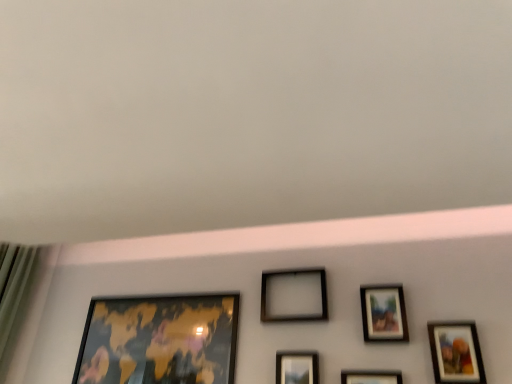
Describe the element at coordinates (370, 377) in the screenshot. This screenshot has height=384, width=512. I see `matte black picture frame at center, the fourth picture frame viewed from the left` at that location.

What do you see at coordinates (159, 340) in the screenshot? Image resolution: width=512 pixels, height=384 pixels. I see `gold metallic map at lower left, which is the first picture frame in left-to-right order` at bounding box center [159, 340].

In order to face matte wooden picture frame at lower right, which appears as the sixth picture frame when viewed from the left, should I rotate leftwards or rightwards?

Turn right by 25.231 degrees to look at matte wooden picture frame at lower right, which appears as the sixth picture frame when viewed from the left.

What is the approximate height of matte black picture frame at center, the 2th picture frame positioned from the left?

The height of matte black picture frame at center, the 2th picture frame positioned from the left, is 20.56 centimeters.

Find the location of a particular element. The image size is (512, 384). matte black picture frame at center, the fourth picture frame viewed from the left is located at coordinates (370, 377).

Does gold metallic map at lower left, which is the first picture frame in left-to-right order, have a larger size compared to matte black picture frame at center, the 2th picture frame positioned from the left?

Indeed, gold metallic map at lower left, which is the first picture frame in left-to-right order, has a larger size compared to matte black picture frame at center, the 2th picture frame positioned from the left.

From the image's perspective, is gold metallic map at lower left, which is the first picture frame in left-to-right order, over matte black picture frame at center, the 2th picture frame positioned from the left?

Yes, from the image's perspective, gold metallic map at lower left, which is the first picture frame in left-to-right order, is above matte black picture frame at center, the 2th picture frame positioned from the left.

Would you say gold metallic map at lower left, the 6th picture frame viewed from the right, is to the left or to the right of matte black picture frame at center, the 2th picture frame positioned from the left, in the picture?

From the image, it's evident that gold metallic map at lower left, the 6th picture frame viewed from the right, is to the left of matte black picture frame at center, the 2th picture frame positioned from the left.

Could matte wooden picture frame at lower right, which appears as the sixth picture frame when viewed from the left, be considered to be inside gold metallic map at lower left, the 6th picture frame viewed from the right?

No, matte wooden picture frame at lower right, which appears as the sixth picture frame when viewed from the left, is not inside gold metallic map at lower left, the 6th picture frame viewed from the right.

Does gold metallic map at lower left, which is the first picture frame in left-to-right order, have a lesser height compared to matte wooden picture frame at lower right, positioned as the 1th picture frame in right-to-left order?

No.

Consider the image. Are gold metallic map at lower left, which is the first picture frame in left-to-right order, and matte wooden picture frame at lower right, which appears as the sixth picture frame when viewed from the left, far apart?

gold metallic map at lower left, which is the first picture frame in left-to-right order, is near matte wooden picture frame at lower right, which appears as the sixth picture frame when viewed from the left, not far away.

Which object is positioned more to the right, gold metallic map at lower left, which is the first picture frame in left-to-right order, or matte wooden picture frame at lower right, positioned as the 1th picture frame in right-to-left order?

matte wooden picture frame at lower right, positioned as the 1th picture frame in right-to-left order.

Does point (300, 370) come behind point (325, 281)?

No, it is in front of (325, 281).

From the image's perspective, starting from the black matte picture frame at center, which ranks as the 3th picture frame in left-to-right order, which picture frame is the 4th one below? Please provide its 2D coordinates.

[(297, 367)]

Is black matte picture frame at center, acting as the fourth picture frame starting from the right, at the back of matte black picture frame at center, the 2th picture frame positioned from the left?

No, matte black picture frame at center, the 2th picture frame positioned from the left,'s orientation is not away from black matte picture frame at center, acting as the fourth picture frame starting from the right.

Between matte black picture frame at center, the fifth picture frame positioned from the right, and matte wooden picture frame at upper right, the 2th picture frame viewed from the right, which one is positioned in front?

matte black picture frame at center, the fifth picture frame positioned from the right, is closer to the camera.

Does matte black picture frame at center, the 2th picture frame positioned from the left, have a lesser width compared to matte wooden picture frame at upper right, the 2th picture frame viewed from the right?

No, matte black picture frame at center, the 2th picture frame positioned from the left, is not thinner than matte wooden picture frame at upper right, the 2th picture frame viewed from the right.

Looking at this image, considering the relative sizes of matte black picture frame at center, the 2th picture frame positioned from the left, and matte wooden picture frame at upper right, positioned as the fifth picture frame in left-to-right order, in the image provided, is matte black picture frame at center, the 2th picture frame positioned from the left, taller than matte wooden picture frame at upper right, positioned as the fifth picture frame in left-to-right order,?

No.

Is matte black picture frame at center, the fifth picture frame positioned from the right, aimed at matte wooden picture frame at upper right, positioned as the fifth picture frame in left-to-right order?

No, matte black picture frame at center, the fifth picture frame positioned from the right, is not turned towards matte wooden picture frame at upper right, positioned as the fifth picture frame in left-to-right order.

Is point (287, 363) closer to camera compared to point (342, 371)?

No, (287, 363) is behind (342, 371).

Considering the relative sizes of matte black picture frame at center, the 2th picture frame positioned from the left, and matte black picture frame at center, the fourth picture frame viewed from the left, in the image provided, is matte black picture frame at center, the 2th picture frame positioned from the left, bigger than matte black picture frame at center, the fourth picture frame viewed from the left,?

Indeed, matte black picture frame at center, the 2th picture frame positioned from the left, has a larger size compared to matte black picture frame at center, the fourth picture frame viewed from the left.

From a real-world perspective, is matte black picture frame at center, the 2th picture frame positioned from the left, positioned under matte black picture frame at center, the fourth picture frame viewed from the left, based on gravity?

Incorrect, from a real-world perspective, matte black picture frame at center, the 2th picture frame positioned from the left, is higher than matte black picture frame at center, the fourth picture frame viewed from the left.

Measure the distance between gold metallic map at lower left, the 6th picture frame viewed from the right, and black matte picture frame at center, which ranks as the 3th picture frame in left-to-right order.

gold metallic map at lower left, the 6th picture frame viewed from the right, and black matte picture frame at center, which ranks as the 3th picture frame in left-to-right order, are 15.65 inches apart from each other.

Is point (211, 352) positioned behind point (279, 279)?

No, it is not.

Does gold metallic map at lower left, which is the first picture frame in left-to-right order, touch black matte picture frame at center, which ranks as the 3th picture frame in left-to-right order?

No, gold metallic map at lower left, which is the first picture frame in left-to-right order, is not making contact with black matte picture frame at center, which ranks as the 3th picture frame in left-to-right order.

Considering the relative sizes of gold metallic map at lower left, the 6th picture frame viewed from the right, and black matte picture frame at center, which ranks as the 3th picture frame in left-to-right order, in the image provided, is gold metallic map at lower left, the 6th picture frame viewed from the right, shorter than black matte picture frame at center, which ranks as the 3th picture frame in left-to-right order,?

Incorrect, the height of gold metallic map at lower left, the 6th picture frame viewed from the right, does not fall short of that of black matte picture frame at center, which ranks as the 3th picture frame in left-to-right order.

Is matte black picture frame at center, which ranks as the 3th picture frame in right-to-left order, positioned before matte wooden picture frame at lower right, which appears as the sixth picture frame when viewed from the left?

No, matte black picture frame at center, which ranks as the 3th picture frame in right-to-left order, is behind matte wooden picture frame at lower right, which appears as the sixth picture frame when viewed from the left.

Considering the relative sizes of matte black picture frame at center, the fourth picture frame viewed from the left, and matte wooden picture frame at lower right, which appears as the sixth picture frame when viewed from the left, in the image provided, is matte black picture frame at center, the fourth picture frame viewed from the left, smaller than matte wooden picture frame at lower right, which appears as the sixth picture frame when viewed from the left,?

Actually, matte black picture frame at center, the fourth picture frame viewed from the left, might be larger than matte wooden picture frame at lower right, which appears as the sixth picture frame when viewed from the left.

In the scene shown: Can you see matte black picture frame at center, which ranks as the 3th picture frame in right-to-left order, touching matte wooden picture frame at lower right, positioned as the 1th picture frame in right-to-left order?

matte black picture frame at center, which ranks as the 3th picture frame in right-to-left order, and matte wooden picture frame at lower right, positioned as the 1th picture frame in right-to-left order, are not in contact.

This screenshot has height=384, width=512. I want to click on the 3rd picture frame above when counting from the matte black picture frame at center, which ranks as the 3th picture frame in right-to-left order (from the image's perspective), so click(x=456, y=352).

Locate an element on the screen. This screenshot has height=384, width=512. the 2nd picture frame positioned above the matte black picture frame at center, the 2th picture frame positioned from the left (from a real-world perspective) is located at coordinates (159, 340).

At what (x,y) coordinates should I click in order to perform the action: click on picture frame that is the 5th one when counting leftward from the matte wooden picture frame at lower right, which appears as the sixth picture frame when viewed from the left. Please return your answer as a coordinate pair (x, y). The width and height of the screenshot is (512, 384). Looking at the image, I should click on (159, 340).

Which object lies further to the anchor point matte wooden picture frame at lower right, positioned as the 1th picture frame in right-to-left order, gold metallic map at lower left, the 6th picture frame viewed from the right, or matte black picture frame at center, the 2th picture frame positioned from the left?

Based on the image, gold metallic map at lower left, the 6th picture frame viewed from the right, appears to be further to matte wooden picture frame at lower right, positioned as the 1th picture frame in right-to-left order.

When comparing their distances from matte wooden picture frame at upper right, positioned as the fifth picture frame in left-to-right order, does matte black picture frame at center, the fourth picture frame viewed from the left, or matte wooden picture frame at lower right, positioned as the 1th picture frame in right-to-left order, seem closer?

matte wooden picture frame at lower right, positioned as the 1th picture frame in right-to-left order, lies closer to matte wooden picture frame at upper right, positioned as the fifth picture frame in left-to-right order, than the other object.

Estimate the real-world distances between objects in this image. Which object is closer to black matte picture frame at center, which ranks as the 3th picture frame in left-to-right order, matte black picture frame at center, the fourth picture frame viewed from the left, or matte wooden picture frame at lower right, which appears as the sixth picture frame when viewed from the left?

matte black picture frame at center, the fourth picture frame viewed from the left, is positioned closer to the anchor black matte picture frame at center, which ranks as the 3th picture frame in left-to-right order.

Considering their positions, is black matte picture frame at center, acting as the fourth picture frame starting from the right, positioned further to matte wooden picture frame at upper right, the 2th picture frame viewed from the right, than matte black picture frame at center, which ranks as the 3th picture frame in right-to-left order?

black matte picture frame at center, acting as the fourth picture frame starting from the right, is further to matte wooden picture frame at upper right, the 2th picture frame viewed from the right.

Based on their spatial positions, is black matte picture frame at center, which ranks as the 3th picture frame in left-to-right order, or gold metallic map at lower left, the 6th picture frame viewed from the right, closer to matte wooden picture frame at lower right, which appears as the sixth picture frame when viewed from the left?

Based on the image, black matte picture frame at center, which ranks as the 3th picture frame in left-to-right order, appears to be nearer to matte wooden picture frame at lower right, which appears as the sixth picture frame when viewed from the left.

Based on their spatial positions, is gold metallic map at lower left, the 6th picture frame viewed from the right, or black matte picture frame at center, acting as the fourth picture frame starting from the right, further from matte black picture frame at center, the fifth picture frame positioned from the right?

gold metallic map at lower left, the 6th picture frame viewed from the right, is further to matte black picture frame at center, the fifth picture frame positioned from the right.

Estimate the real-world distances between objects in this image. Which object is closer to matte black picture frame at center, the 2th picture frame positioned from the left, black matte picture frame at center, acting as the fourth picture frame starting from the right, or matte black picture frame at center, the fourth picture frame viewed from the left?

matte black picture frame at center, the fourth picture frame viewed from the left.

From the image, which object appears to be nearer to matte wooden picture frame at upper right, positioned as the fifth picture frame in left-to-right order, gold metallic map at lower left, the 6th picture frame viewed from the right, or black matte picture frame at center, which ranks as the 3th picture frame in left-to-right order?

black matte picture frame at center, which ranks as the 3th picture frame in left-to-right order, is positioned closer to the anchor matte wooden picture frame at upper right, positioned as the fifth picture frame in left-to-right order.

I want to click on picture frame located between gold metallic map at lower left, which is the first picture frame in left-to-right order, and black matte picture frame at center, acting as the fourth picture frame starting from the right, in the left-right direction, so click(297, 367).

You are a GUI agent. You are given a task and a screenshot of the screen. Output one action in this format:
    pyautogui.click(x=<x>, y=<y>)
    Task: Click on the picture frame between matte black picture frame at center, which ranks as the 3th picture frame in right-to-left order, and matte wooden picture frame at lower right, which appears as the sixth picture frame when viewed from the left, from left to right
    This screenshot has height=384, width=512.
    Given the screenshot: What is the action you would take?
    pyautogui.click(x=383, y=313)

You are a GUI agent. You are given a task and a screenshot of the screen. Output one action in this format:
    pyautogui.click(x=<x>, y=<y>)
    Task: Click on the picture frame between black matte picture frame at center, acting as the fourth picture frame starting from the right, and matte wooden picture frame at upper right, the 2th picture frame viewed from the right, in the horizontal direction
    The height and width of the screenshot is (384, 512).
    Given the screenshot: What is the action you would take?
    pyautogui.click(x=370, y=377)